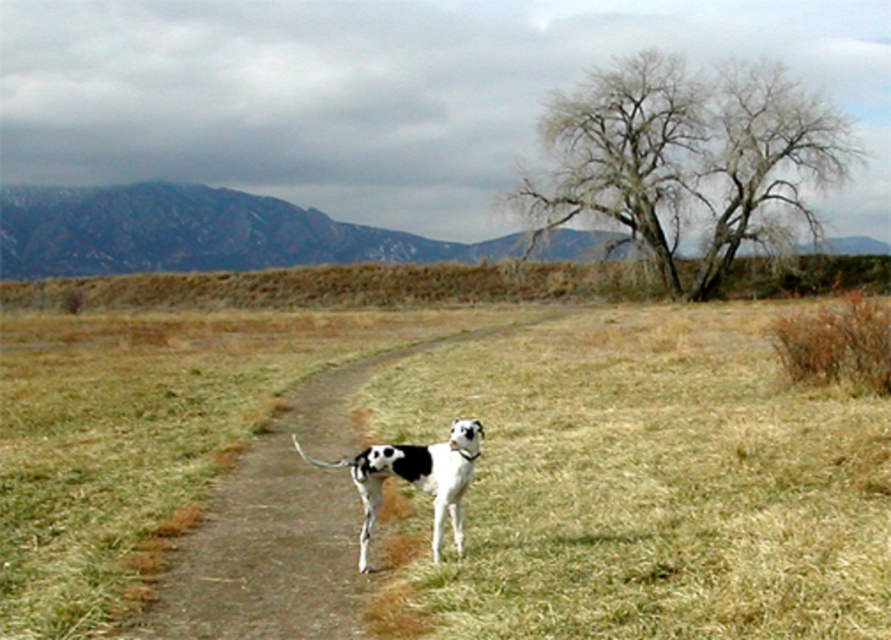
Question: Among these objects, which one is nearest to the camera?

Choices:
 (A) white-spotted fur dog at center
 (B) white smooth dog at center

Answer: (B)

Question: Observing the image, what is the correct spatial positioning of white smooth dog at center in reference to white-spotted fur dog at center?

Choices:
 (A) right
 (B) left

Answer: (B)

Question: Is white smooth dog at center to the left of white-spotted fur dog at center from the viewer's perspective?

Choices:
 (A) yes
 (B) no

Answer: (A)

Question: From the image, what is the correct spatial relationship of white smooth dog at center in relation to white-spotted fur dog at center?

Choices:
 (A) right
 (B) left

Answer: (B)